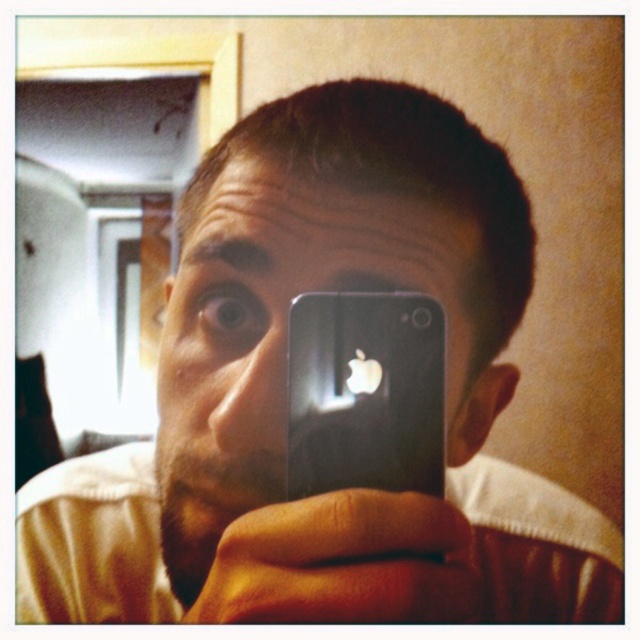
Question: Which point is farther to the camera?

Choices:
 (A) (417, 499)
 (B) (428, 404)

Answer: (B)

Question: Among these objects, which one is farthest from the camera?

Choices:
 (A) black matte smartphone at center
 (B) matte black phone at center

Answer: (A)

Question: Does matte black phone at center have a larger size compared to black matte smartphone at center?

Choices:
 (A) yes
 (B) no

Answer: (A)

Question: From the image, what is the correct spatial relationship of matte black phone at center in relation to black matte smartphone at center?

Choices:
 (A) left
 (B) right

Answer: (A)

Question: Does matte black phone at center appear over black matte smartphone at center?

Choices:
 (A) no
 (B) yes

Answer: (B)